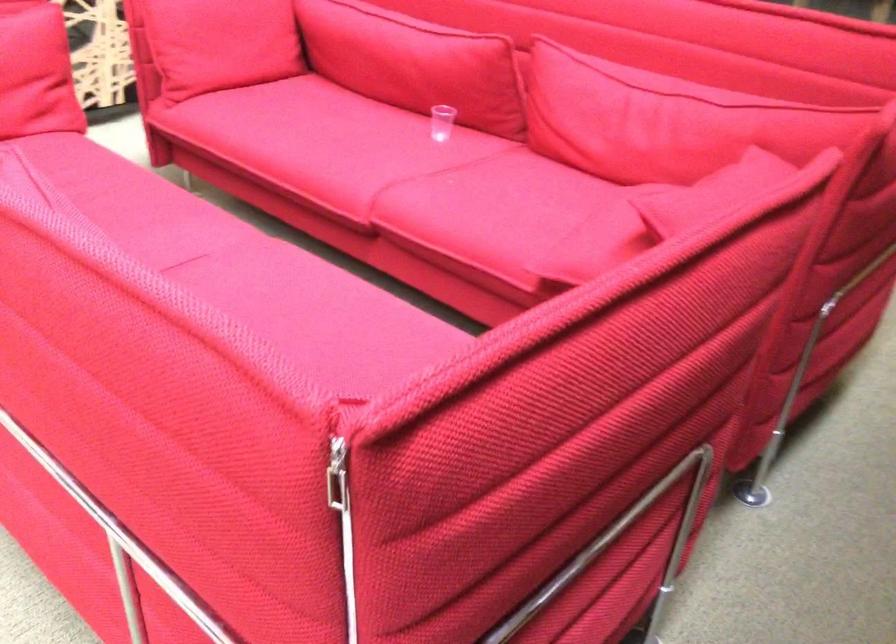
Describe the element at coordinates (691, 222) in the screenshot. I see `the red sofa armrest` at that location.